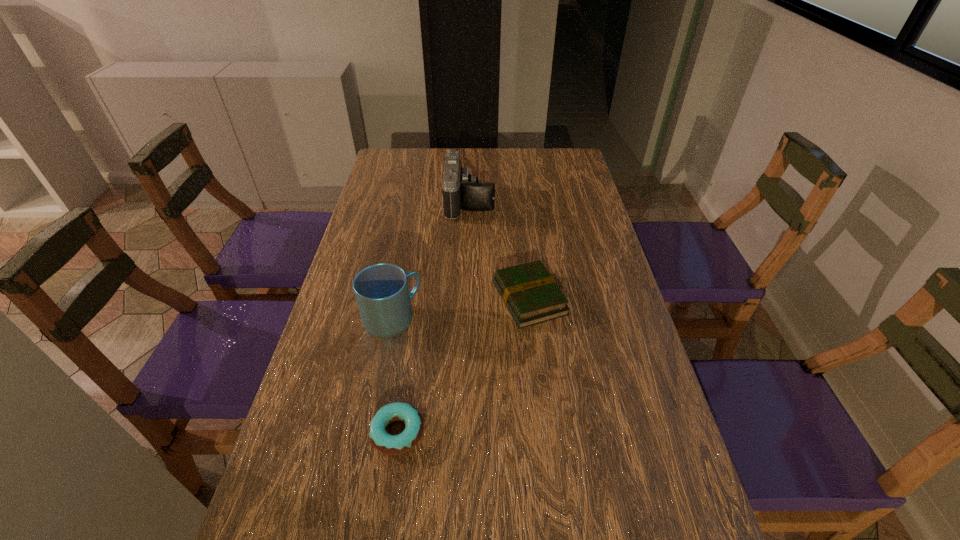
In the image, there is a desktop. Where is `blank space at the far edge`? blank space at the far edge is located at coordinates (526, 176).

You are a GUI agent. You are given a task and a screenshot of the screen. Output one action in this format:
    pyautogui.click(x=<x>, y=<y>)
    Task: Click on the vacant space at the left edge of the desktop
    Image resolution: width=960 pixels, height=540 pixels.
    Given the screenshot: What is the action you would take?
    pyautogui.click(x=360, y=329)

You are a GUI agent. You are given a task and a screenshot of the screen. Output one action in this format:
    pyautogui.click(x=<x>, y=<y>)
    Task: Click on the vacant space at the right edge of the desktop
    
    Given the screenshot: What is the action you would take?
    pyautogui.click(x=565, y=226)

Identify the location of vacant space at the far left corner of the desktop. The height and width of the screenshot is (540, 960). (402, 156).

Locate an element on the screen. vacant space at the far right corner is located at coordinates (576, 152).

You are a GUI agent. You are given a task and a screenshot of the screen. Output one action in this format:
    pyautogui.click(x=<x>, y=<y>)
    Task: Click on the empty location between the farthest object and the second shortest object
    Image resolution: width=960 pixels, height=540 pixels.
    Given the screenshot: What is the action you would take?
    pyautogui.click(x=499, y=251)

At what (x,y) coordinates should I click in order to perform the action: click on vacant space in between the book and the farthest object. Please return your answer as a coordinate pair (x, y). The height and width of the screenshot is (540, 960). Looking at the image, I should click on (499, 251).

Where is `free space between the mug and the camera`? free space between the mug and the camera is located at coordinates (431, 261).

In order to click on vacant area that lies between the doughnut and the mug in this screenshot , I will do `click(395, 376)`.

In order to click on empty space between the mug and the farthest object in this screenshot , I will do `click(431, 261)`.